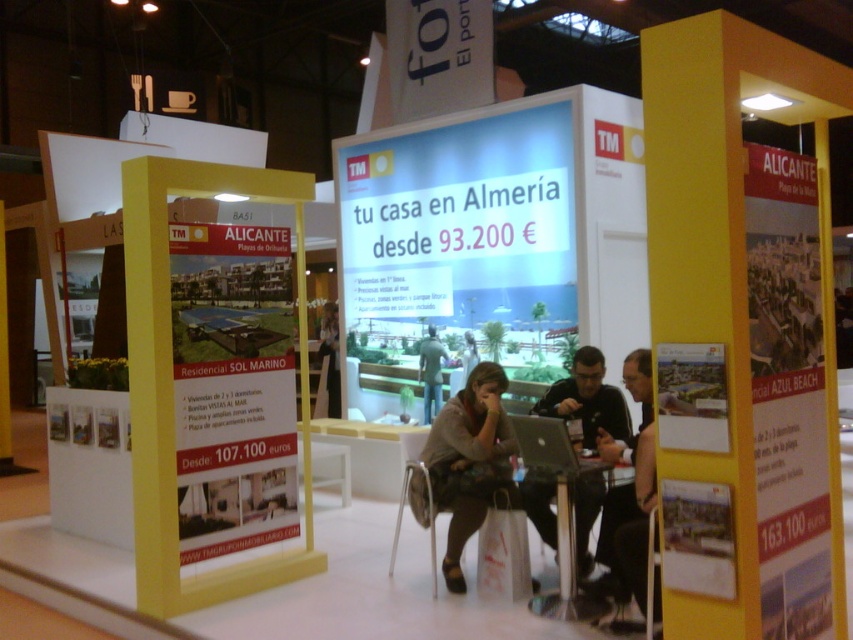
Can you confirm if brown fabric shirt at center is taller than matte black laptop at center?

In fact, brown fabric shirt at center may be shorter than matte black laptop at center.

Looking at this image, is brown fabric shirt at center shorter than matte black laptop at center?

Indeed, brown fabric shirt at center has a lesser height compared to matte black laptop at center.

Between point (463, 394) and point (641, 477), which one is positioned in front?

Point (641, 477)

Locate an element on the screen. The height and width of the screenshot is (640, 853). brown fabric shirt at center is located at coordinates (467, 464).

Which is more to the right, dark gray fabric jacket at center or metallic silver table at center?

dark gray fabric jacket at center

Which is below, dark gray fabric jacket at center or metallic silver table at center?

metallic silver table at center

Between point (576, 388) and point (563, 528), which one is positioned in front?

Point (563, 528) is more forward.

Locate an element on the screen. Image resolution: width=853 pixels, height=640 pixels. dark gray fabric jacket at center is located at coordinates (587, 401).

Can you confirm if brown fabric shirt at center is thinner than dark gray fabric jacket at center?

No.

Who is positioned more to the left, brown fabric shirt at center or dark gray fabric jacket at center?

brown fabric shirt at center

The height and width of the screenshot is (640, 853). In order to click on brown fabric shirt at center in this screenshot , I will do `click(467, 464)`.